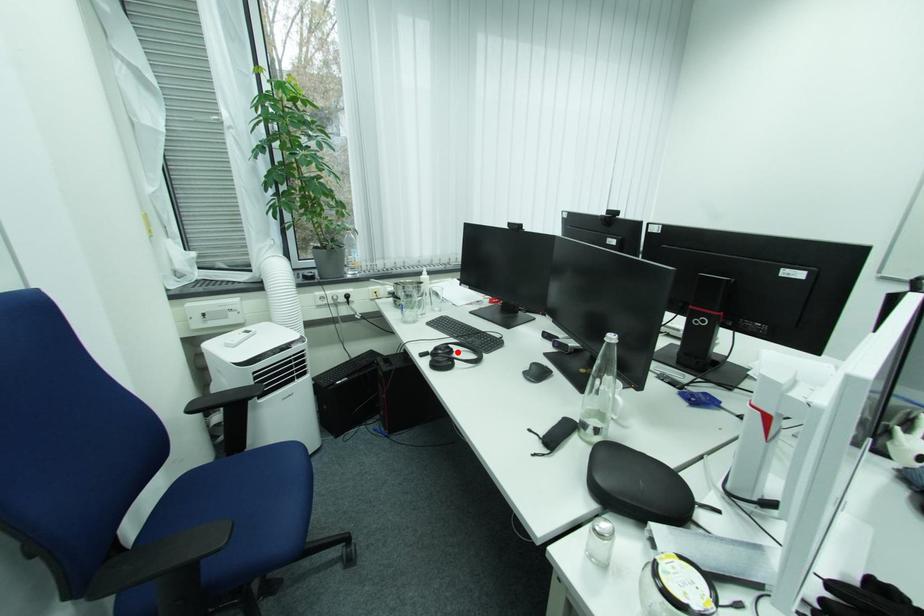
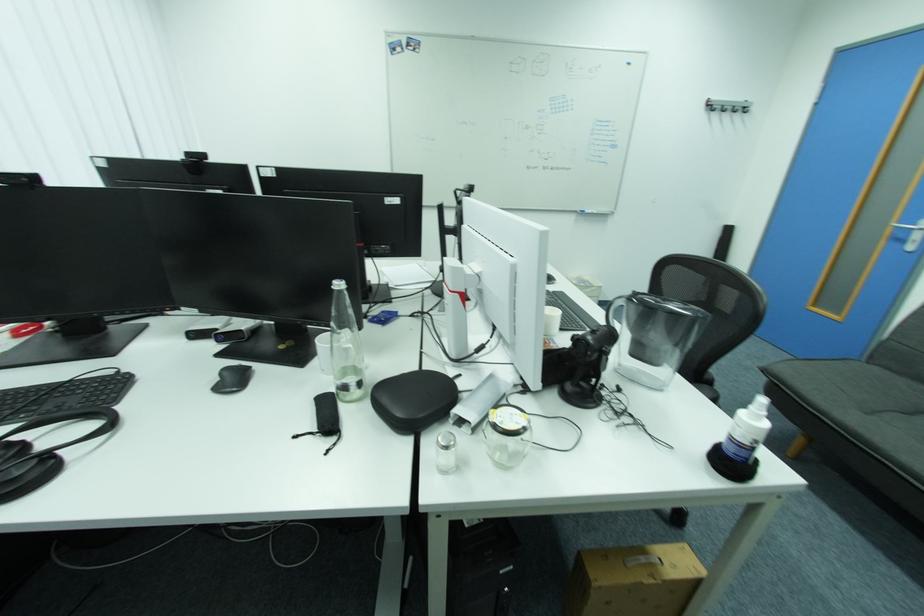
In the second image, find the point that corresponds to the highlighted location in the first image.

(29, 447)